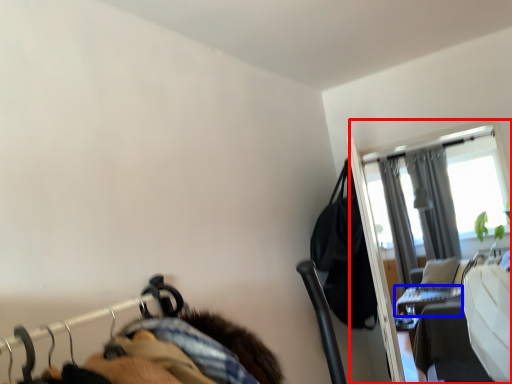
Question: Which point is further to the camera, screen door (highlighted by a red box) or table (highlighted by a blue box)?

Choices:
 (A) screen door
 (B) table

Answer: (B)